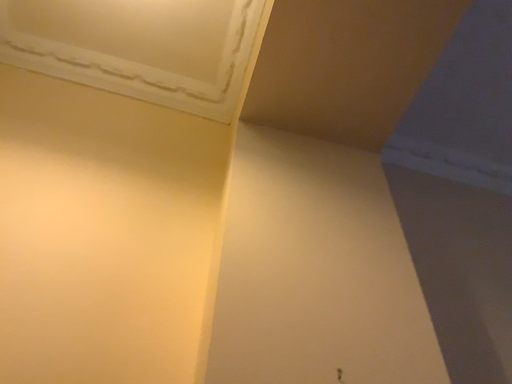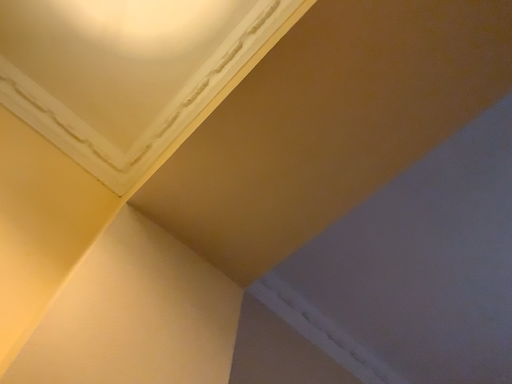
Question: How did the camera likely rotate when shooting the video?

Choices:
 (A) rotated left
 (B) rotated right

Answer: (B)